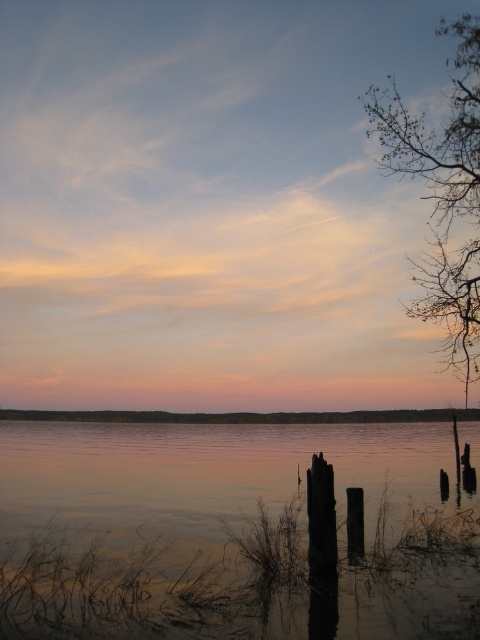
Between smooth reflective water at center and bare branches at upper right, which one appears on the right side from the viewer's perspective?

Positioned to the right is bare branches at upper right.

What do you see at coordinates (233, 531) in the screenshot? I see `smooth reflective water at center` at bounding box center [233, 531].

Who is more distant from viewer, (313,625) or (447,307)?

Point (447,307)

Locate an element on the screen. The width and height of the screenshot is (480, 640). smooth reflective water at center is located at coordinates (233, 531).